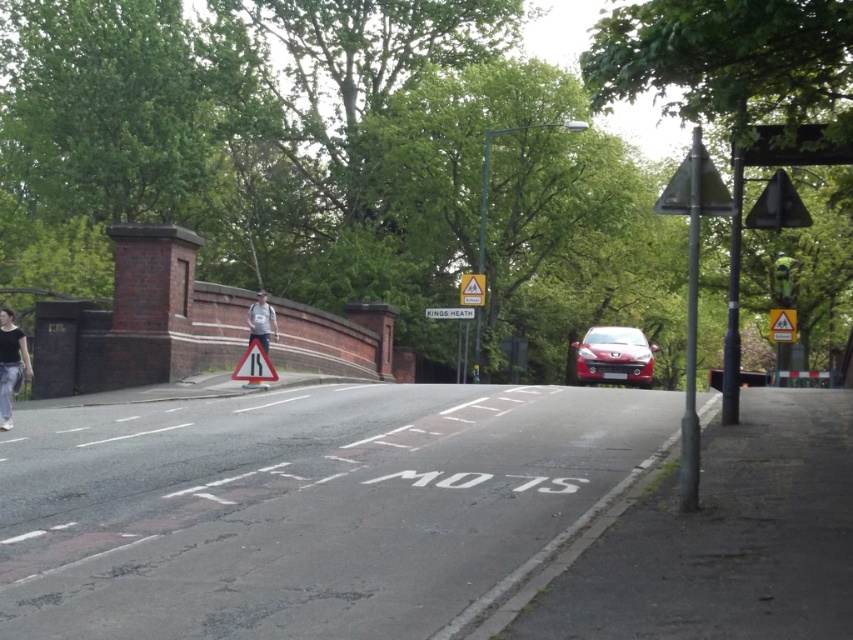
Question: Which of the following is the farthest from the observer?

Choices:
 (A) (461, 276)
 (B) (776, 332)
 (C) (273, 324)

Answer: (A)

Question: Among these objects, which one is farthest from the camera?

Choices:
 (A) white plastic sign at center
 (B) matte red car at center
 (C) denim pants at lower left

Answer: (A)

Question: Which of these objects is positioned farthest from the yellow reflective triangle at upper center?

Choices:
 (A) matte red car at center
 (B) gray fabric jacket at center
 (C) yellow reflective triangle at upper right

Answer: (C)

Question: Observing the image, what is the correct spatial positioning of matte red car at center in reference to white plastic sign at center?

Choices:
 (A) left
 (B) right

Answer: (B)

Question: Can you confirm if gray fabric jacket at center is wider than yellow reflective triangle at upper center?

Choices:
 (A) yes
 (B) no

Answer: (B)

Question: Can you confirm if gray fabric jacket at center is thinner than white plastic sign at center?

Choices:
 (A) no
 (B) yes

Answer: (B)